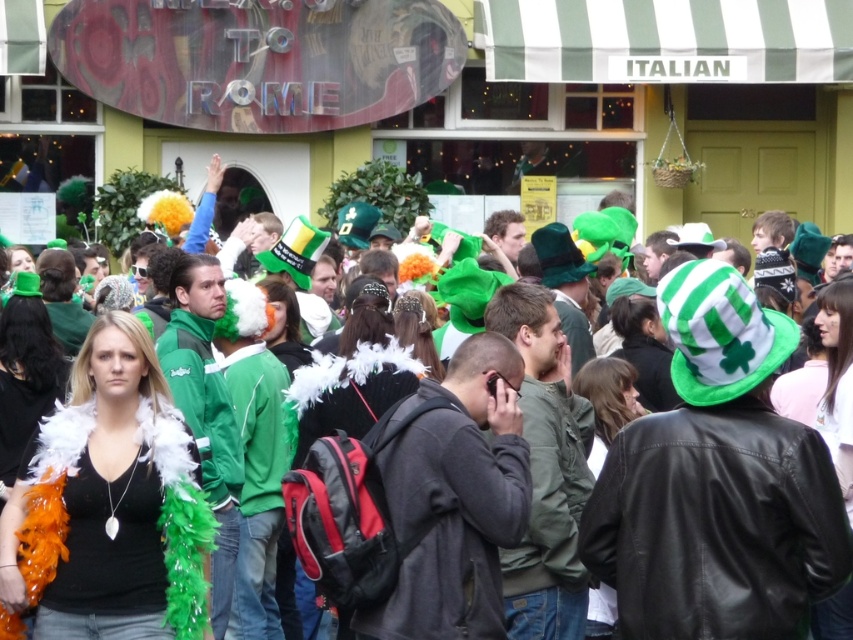
In the scene shown: Does black feather boa at center appear under white feather boa at center?

Answer: Correct, black feather boa at center is located below white feather boa at center.

Between point (100, 401) and point (426, 330), which one is positioned in front?

Point (100, 401)

I want to click on black feather boa at center, so click(x=108, y=506).

Between black feather boa at center and feather boa at center, which one has more height?

feather boa at center is taller.

Which is above, black feather boa at center or feather boa at center?

Positioned higher is feather boa at center.

You are a GUI agent. You are given a task and a screenshot of the screen. Output one action in this format:
    pyautogui.click(x=<x>, y=<y>)
    Task: Click on the black feather boa at center
    Image resolution: width=853 pixels, height=640 pixels.
    Given the screenshot: What is the action you would take?
    pyautogui.click(x=108, y=506)

Is feather boa at center bigger than white feather boa at center?

Correct, feather boa at center is larger in size than white feather boa at center.

Which is behind, point (341, 636) or point (426, 321)?

Point (426, 321)

Is point (381, 392) positioned before point (410, 308)?

Yes, it is.

I want to click on feather boa at center, so click(x=352, y=406).